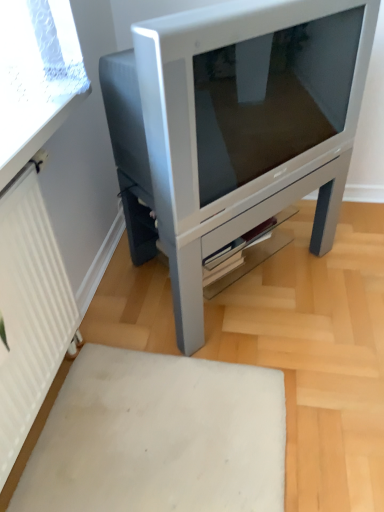
In order to click on unoccupied space behind white ribbed radiator at left in this screenshot , I will do `click(117, 307)`.